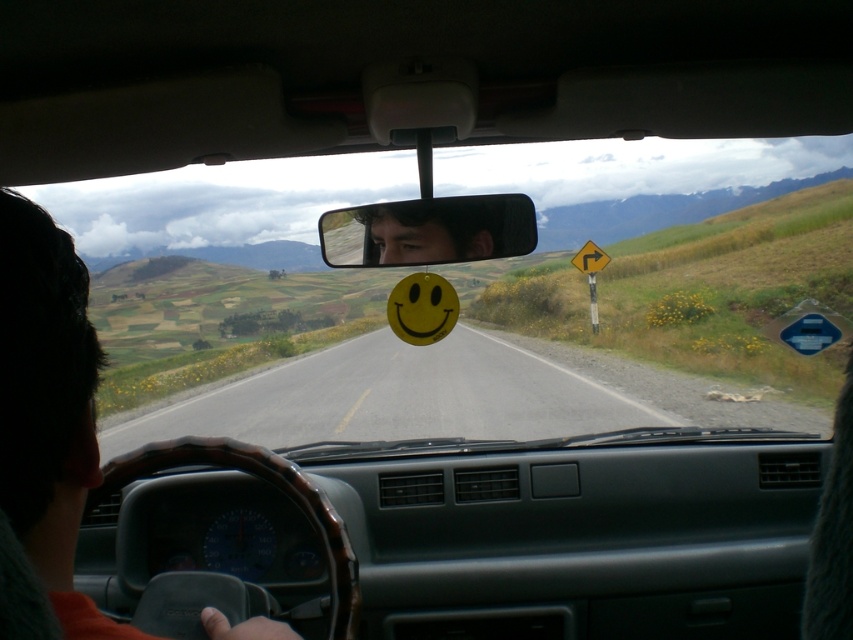
Question: Can you confirm if brown leather steering wheel at lower left is positioned to the left of matte plastic mirror at center?

Choices:
 (A) no
 (B) yes

Answer: (B)

Question: Does smooth asphalt road at center come behind smooth skin face at center?

Choices:
 (A) yes
 (B) no

Answer: (A)

Question: From the image, what is the correct spatial relationship of smooth asphalt road at center in relation to matte plastic mirror at center?

Choices:
 (A) left
 (B) right

Answer: (B)

Question: Which object appears closest to the camera in this image?

Choices:
 (A) matte plastic mirror at center
 (B) smooth skin face at center
 (C) brown leather steering wheel at lower left

Answer: (C)

Question: Which is farther from the smooth asphalt road at center?

Choices:
 (A) matte plastic mirror at center
 (B) smooth skin face at center

Answer: (A)

Question: Which point is farther to the camera?

Choices:
 (A) (442, 253)
 (B) (26, 392)

Answer: (A)